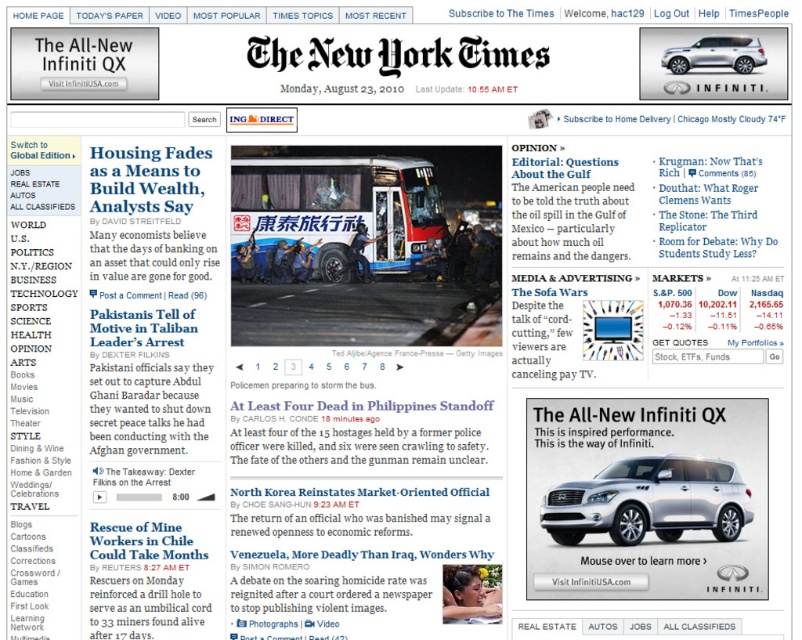
Can you confirm if silver metallic suv at center is shorter than satin silver suv at upper right?

Incorrect, silver metallic suv at center's height does not fall short of satin silver suv at upper right's.

What do you see at coordinates (649, 500) in the screenshot? The height and width of the screenshot is (640, 802). I see `silver metallic suv at center` at bounding box center [649, 500].

This screenshot has width=802, height=640. Describe the element at coordinates (649, 500) in the screenshot. I see `silver metallic suv at center` at that location.

The width and height of the screenshot is (802, 640). In order to click on silver metallic suv at center in this screenshot , I will do `click(649, 500)`.